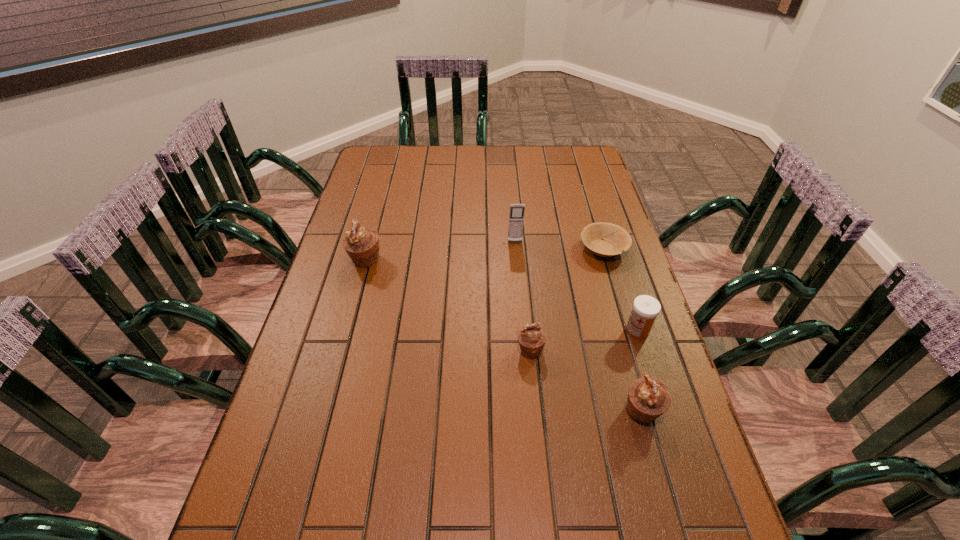
This screenshot has height=540, width=960. In order to click on vacant space at the near edge of the desktop in this screenshot , I will do `click(544, 485)`.

At what (x,y) coordinates should I click in order to perform the action: click on blank space at the left edge of the desktop. Please return your answer as a coordinate pair (x, y). The width and height of the screenshot is (960, 540). Looking at the image, I should click on (343, 382).

This screenshot has width=960, height=540. In order to click on vacant area at the right edge in this screenshot , I will do `click(654, 377)`.

The height and width of the screenshot is (540, 960). What are the coordinates of `free space that is in between the second nearest muffin and the leftmost muffin` in the screenshot? It's located at [x=448, y=306].

This screenshot has height=540, width=960. Identify the location of empty space between the farthest muffin and the second farthest muffin. (448, 306).

What are the coordinates of `free space that is in between the rightmost muffin and the bowl` in the screenshot? It's located at (623, 330).

I want to click on empty space between the cellular telephone and the tallest muffin, so click(441, 252).

At what (x,y) coordinates should I click in order to perform the action: click on free point between the bowl and the second muffin from left to right. Please return your answer as a coordinate pair (x, y). The height and width of the screenshot is (540, 960). Looking at the image, I should click on [x=566, y=300].

Where is `vacant area that lies between the rightmost muffin and the shortest muffin`? The width and height of the screenshot is (960, 540). vacant area that lies between the rightmost muffin and the shortest muffin is located at coordinates (586, 381).

At what (x,y) coordinates should I click in order to perform the action: click on unoccupied area between the cellular telephone and the shortest muffin. Please return your answer as a coordinate pair (x, y). Looking at the image, I should click on (522, 296).